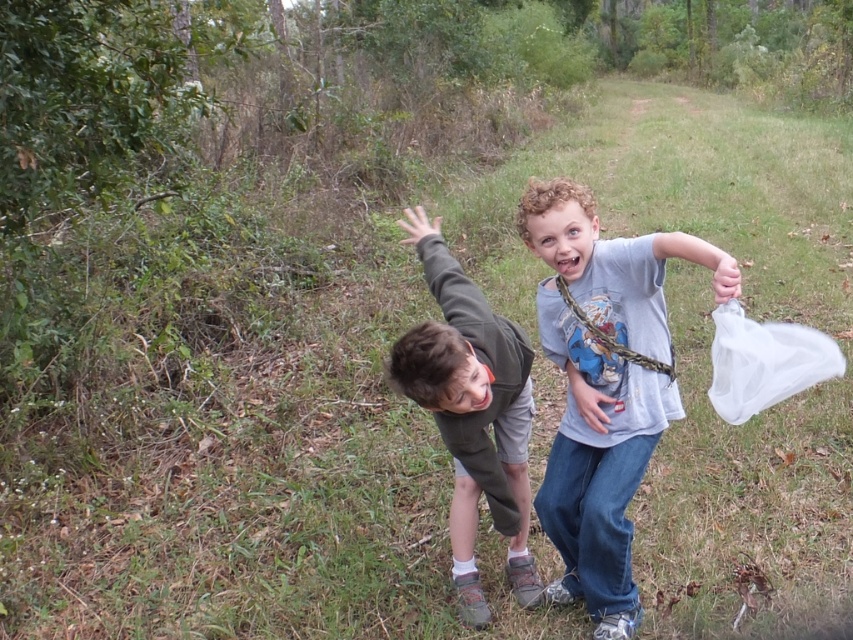
Question: Which is nearer to the dark gray fabric shirt at center?

Choices:
 (A) transparent plastic bag at right
 (B) gray cotton shirt at center

Answer: (B)

Question: Which object is positioned farthest from the transparent plastic bag at right?

Choices:
 (A) dark gray fabric shirt at center
 (B) gray cotton shirt at center

Answer: (A)

Question: Observing the image, what is the correct spatial positioning of gray cotton shirt at center in reference to transparent plastic bag at right?

Choices:
 (A) right
 (B) left

Answer: (B)

Question: Which is nearer to the gray cotton shirt at center?

Choices:
 (A) transparent plastic bag at right
 (B) dark gray fabric shirt at center

Answer: (B)

Question: Is gray cotton shirt at center to the right of transparent plastic bag at right from the viewer's perspective?

Choices:
 (A) no
 (B) yes

Answer: (A)

Question: Is gray cotton shirt at center wider than transparent plastic bag at right?

Choices:
 (A) yes
 (B) no

Answer: (A)